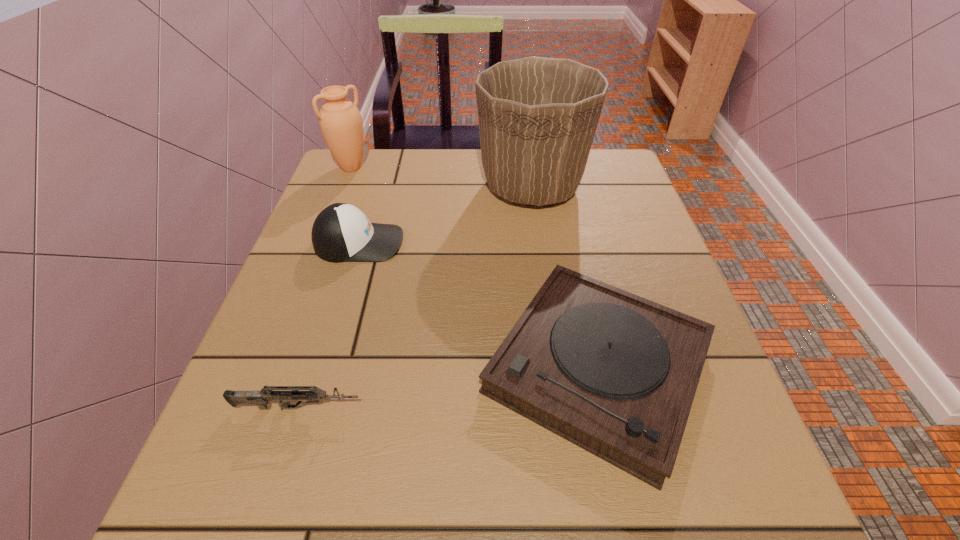
Where is `free space between the gun and the third nearest object`? free space between the gun and the third nearest object is located at coordinates (328, 325).

The width and height of the screenshot is (960, 540). I want to click on empty space between the urn and the third nearest object, so click(355, 205).

This screenshot has width=960, height=540. In order to click on free space between the urn and the third nearest object in this screenshot , I will do `click(355, 205)`.

At what (x,y) coordinates should I click in order to perform the action: click on empty location between the second tallest object and the gun. Please return your answer as a coordinate pair (x, y). The image size is (960, 540). Looking at the image, I should click on click(324, 288).

What are the coordinates of `empty location between the gun and the phonograph record` in the screenshot? It's located at (447, 387).

This screenshot has height=540, width=960. Identify the location of free spot between the tallest object and the second tallest object. (442, 177).

Locate an element on the screen. The width and height of the screenshot is (960, 540). free point between the fourth shortest object and the third shortest object is located at coordinates (355, 205).

In order to click on the closest object to the flowerpot in this screenshot , I will do `click(341, 232)`.

Locate an element on the screen. The width and height of the screenshot is (960, 540). object that is the nearest to the second tallest object is located at coordinates (341, 232).

Locate an element on the screen. The width and height of the screenshot is (960, 540). free point that satisfies the following two spatial constraints: 1. on the front side of the flowerpot; 2. aimed along the barrel of the gun is located at coordinates (564, 408).